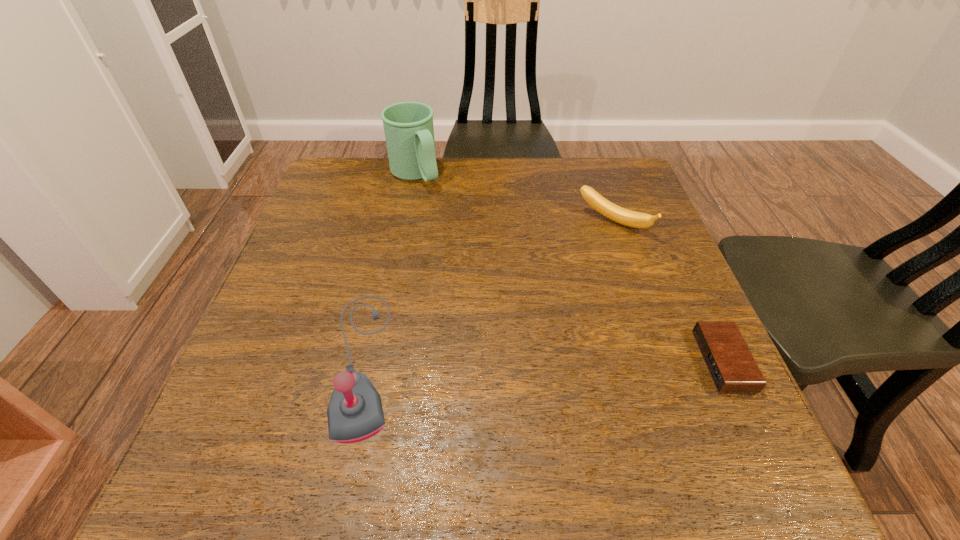
Locate an element on the screen. free space located on the side of the tallest object with the handle is located at coordinates tap(487, 264).

Identify the location of free space located on the side of the tallest object with the handle. The height and width of the screenshot is (540, 960). (496, 274).

The height and width of the screenshot is (540, 960). I want to click on free spot located 0.340m on the side of the tallest object with the handle, so click(489, 266).

Find the location of `vacant space located 0.140m at the stem of the banana`. vacant space located 0.140m at the stem of the banana is located at coordinates (574, 272).

The height and width of the screenshot is (540, 960). I want to click on vacant space located at the stem of the banana, so click(580, 264).

I want to click on vacant area located at the stem of the banana, so click(588, 252).

Where is `object present at the far edge`? object present at the far edge is located at coordinates (409, 132).

Where is `joystick that is at the near edge`? joystick that is at the near edge is located at coordinates (355, 413).

Locate an element on the screen. This screenshot has width=960, height=540. alarm clock positioned at the near edge is located at coordinates (729, 361).

Locate an element on the screen. alarm clock positioned at the right edge is located at coordinates (729, 361).